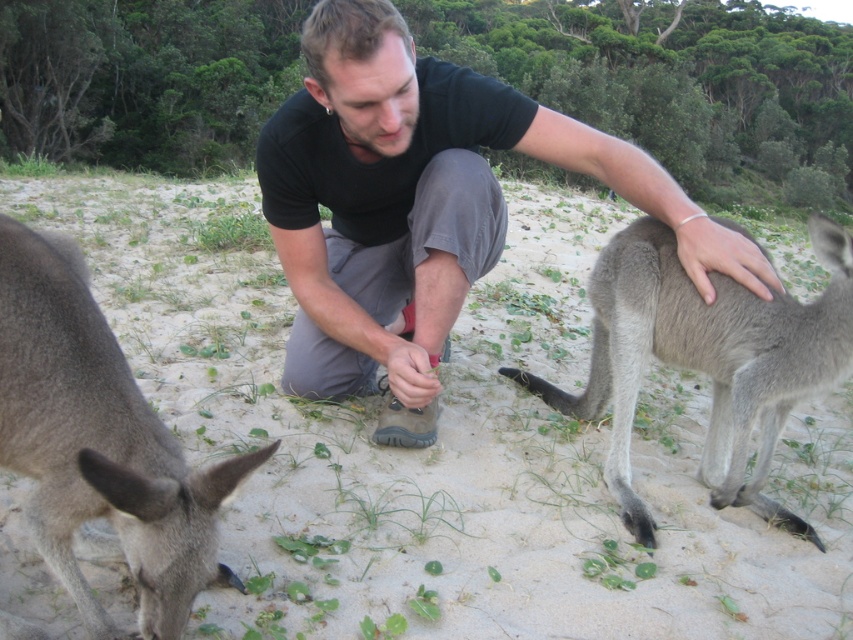
Question: Does black cotton shirt at center lie behind gray fur kangaroo at lower left?

Choices:
 (A) yes
 (B) no

Answer: (A)

Question: Among these objects, which one is nearest to the camera?

Choices:
 (A) gray fur kangaroo at center
 (B) sandy beige sand at center
 (C) black cotton shirt at center

Answer: (B)

Question: In this image, where is black cotton shirt at center located relative to gray fur kangaroo at center?

Choices:
 (A) right
 (B) left

Answer: (B)

Question: Which object is closer to the camera taking this photo?

Choices:
 (A) black cotton shirt at center
 (B) gray fur kangaroo at center

Answer: (A)

Question: Which point is farther to the camera?

Choices:
 (A) gray fur kangaroo at center
 (B) black cotton shirt at center
 (C) gray fur kangaroo at lower left

Answer: (A)

Question: From the image, what is the correct spatial relationship of sandy beige sand at center in relation to gray fur kangaroo at lower left?

Choices:
 (A) left
 (B) right

Answer: (B)